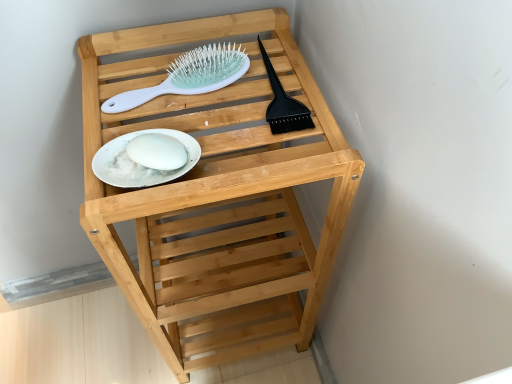
At what (x,y) coordinates should I click in order to perform the action: click on vacant space behind white glossy plate at center. Please return your answer as a coordinate pair (x, y). Looking at the image, I should click on (172, 61).